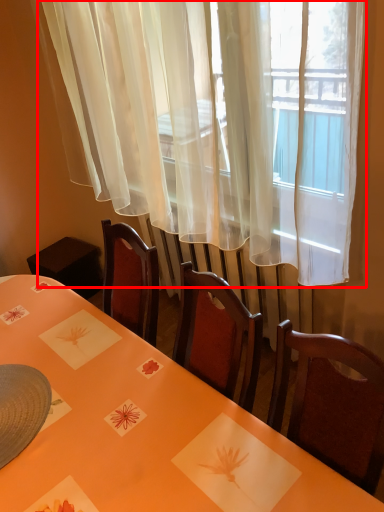
Question: From the image's perspective, where is curtain (annotated by the red box) located relative to table?

Choices:
 (A) below
 (B) above

Answer: (B)